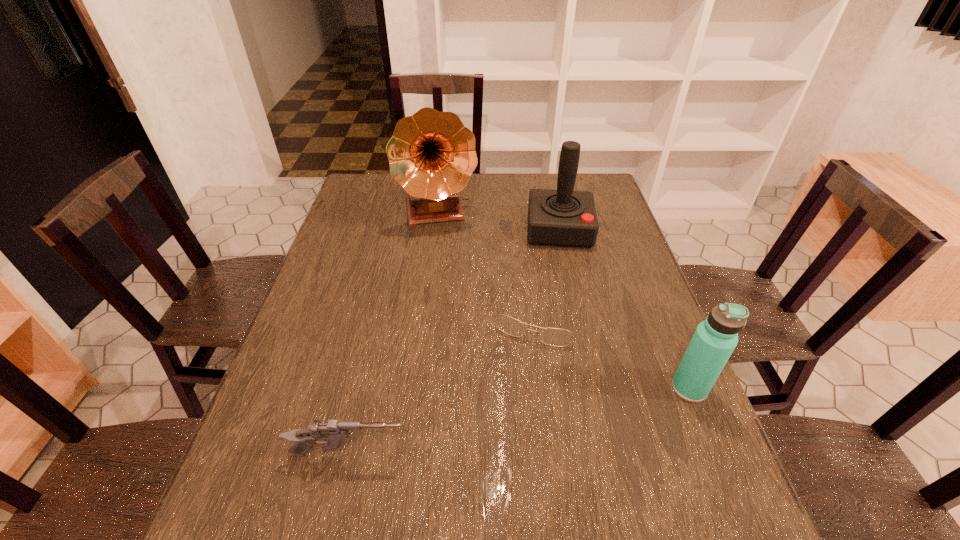
The height and width of the screenshot is (540, 960). In order to click on object that is the third nearest to the fourth farthest object in this screenshot , I will do `click(333, 433)`.

Choose which object is the second nearest neighbor to the spectacles. Please provide its 2D coordinates. Your answer should be formatted as a tuple, i.e. [(x, y)], where the tuple contains the x and y coordinates of a point satisfying the conditions above.

[(714, 340)]

Locate an element on the screen. free space that satisfies the following two spatial constraints: 1. on the front side of the shortest object; 2. on the left side of the phonograph_record is located at coordinates (428, 315).